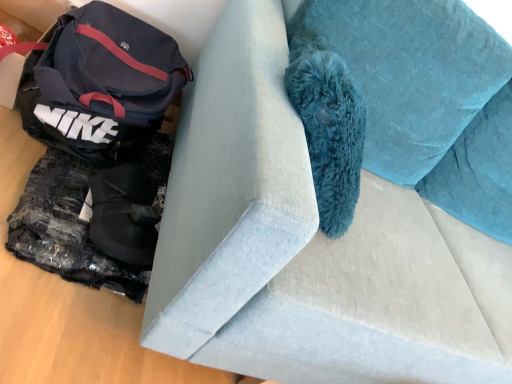
Question: Considering the positions of point (510, 359) and point (62, 54), is point (510, 359) closer or farther from the camera than point (62, 54)?

Choices:
 (A) farther
 (B) closer

Answer: (B)

Question: Do you think suede couch at center is within matte black bag at left, or outside of it?

Choices:
 (A) outside
 (B) inside

Answer: (A)

Question: Looking at the image, does suede couch at center seem bigger or smaller compared to matte black bag at left?

Choices:
 (A) small
 (B) big

Answer: (B)

Question: From a real-world perspective, is matte black bag at left positioned above or below suede couch at center?

Choices:
 (A) below
 (B) above

Answer: (A)

Question: Based on their sizes in the image, would you say matte black bag at left is bigger or smaller than suede couch at center?

Choices:
 (A) small
 (B) big

Answer: (A)

Question: In terms of height, does matte black bag at left look taller or shorter compared to suede couch at center?

Choices:
 (A) tall
 (B) short

Answer: (B)

Question: Choose the correct answer: Is matte black bag at left inside suede couch at center or outside it?

Choices:
 (A) outside
 (B) inside

Answer: (A)